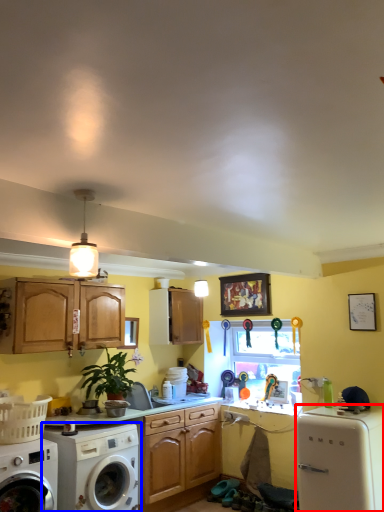
Question: Which of the following is the farthest to the observer, dish washer (highlighted by a red box) or washing machine (highlighted by a blue box)?

Choices:
 (A) dish washer
 (B) washing machine

Answer: (B)